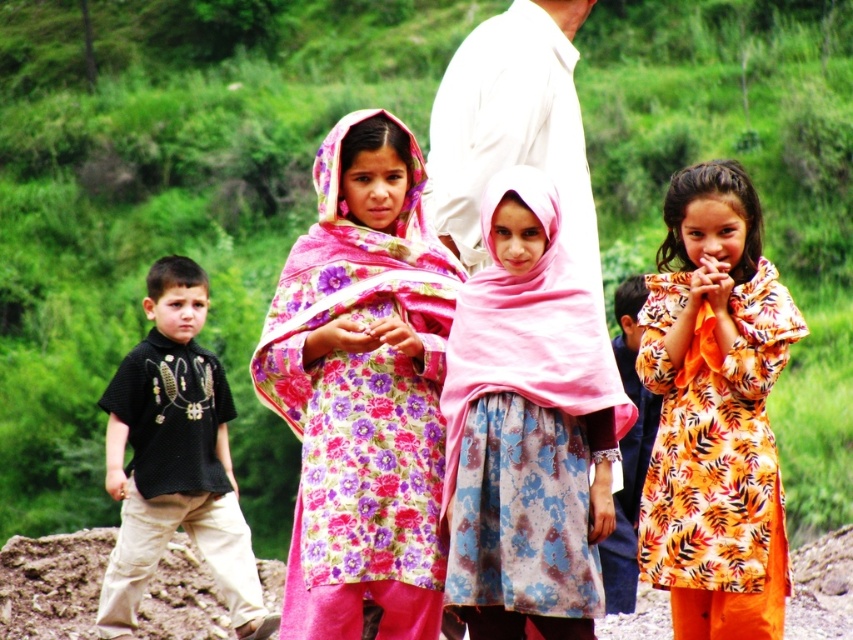
You are a photographer trying to capture a photo of the children. You notice two points in the scene marked as point 1 at coordinate [544,276] and point 2 at coordinate [49,560]. If you want to focus on the point closer to you, which point should you select?

Point 1 at coordinate [544,276] is closer to the camera than point 2 at coordinate [49,560], so you should select point 1 at coordinate [544,276].

You are a photographer trying to capture a group photo of the children in the scene. The children are standing in a line. The girl with the pink fabric headscarf at center is in the middle of the line. The other children are positioned to her left and right. If you want to ensure that all children are in focus, what should you consider about their distance?

The children are 68.10 feet apart, so you should ensure that the depth of field in your camera is sufficient to cover the entire distance between the closest and farthest children to keep them all in focus.

You are a photographer trying to capture the children in the scene. You want to ensure that both the printed cotton dress at center and the black cotton shirt at left are clearly visible in your shot. Given their sizes, which clothing item might require you to adjust your camera angle to avoid being too small in the frame?

The printed cotton dress at center has a lesser width compared to the black cotton shirt at left, so you might need to adjust your camera angle to ensure the smaller printed cotton dress at center is not too small in the frame.